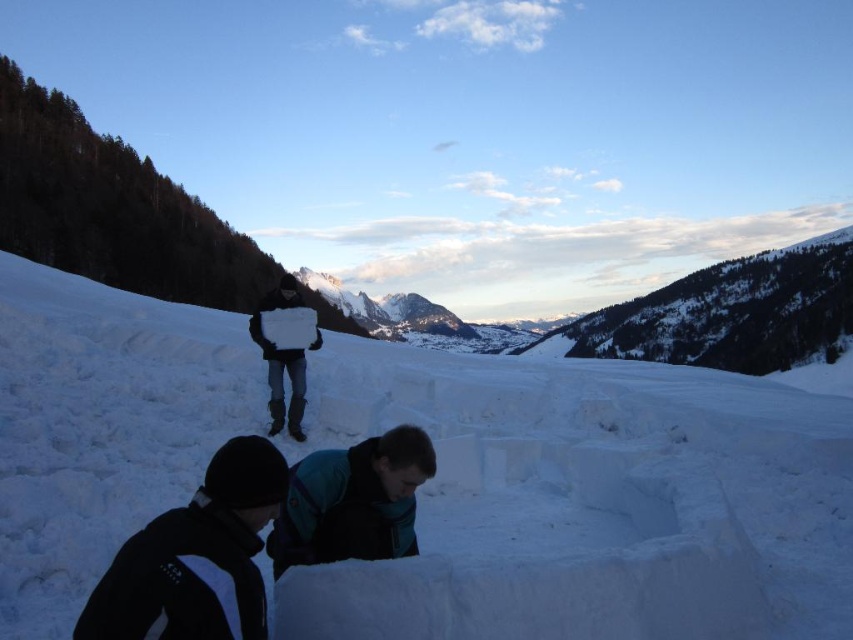
Is white frosty snow at center wider than white paper at center?

Yes, white frosty snow at center is wider than white paper at center.

Based on the photo, can you confirm if white frosty snow at center is thinner than white paper at center?

Incorrect, white frosty snow at center's width is not less than white paper at center's.

I want to click on white frosty snow at center, so click(590, 502).

I want to click on white frosty snow at center, so click(590, 502).

Can you confirm if black soft jacket at lower center is positioned below teal fabric jacket at lower center?

Yes.

Does black soft jacket at lower center have a larger size compared to teal fabric jacket at lower center?

Yes, black soft jacket at lower center is bigger than teal fabric jacket at lower center.

Is point (135, 627) farther from viewer compared to point (299, 465)?

No.

This screenshot has width=853, height=640. What are the coordinates of `black soft jacket at lower center` in the screenshot? It's located at (196, 557).

In the scene shown: Which is below, white frosty snow at center or teal fabric jacket at lower center?

teal fabric jacket at lower center

Between white frosty snow at center and teal fabric jacket at lower center, which one is positioned higher?

Positioned higher is white frosty snow at center.

Where is `white frosty snow at center`? white frosty snow at center is located at coordinates (590, 502).